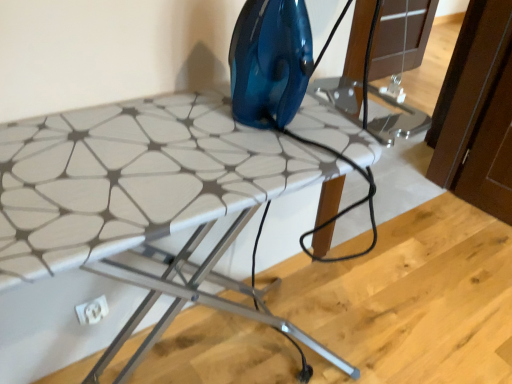
Question: Is white plastic electric outlet at lower left taller or shorter than white textured ironing board at center?

Choices:
 (A) short
 (B) tall

Answer: (A)

Question: Is white plastic electric outlet at lower left bigger or smaller than white textured ironing board at center?

Choices:
 (A) big
 (B) small

Answer: (B)

Question: Considering the positions of point (92, 314) and point (59, 238), is point (92, 314) closer or farther from the camera than point (59, 238)?

Choices:
 (A) closer
 (B) farther

Answer: (B)

Question: Does point (9, 241) appear closer or farther from the camera than point (89, 324)?

Choices:
 (A) closer
 (B) farther

Answer: (A)

Question: In terms of height, does white textured ironing board at center look taller or shorter compared to white plastic electric outlet at lower left?

Choices:
 (A) short
 (B) tall

Answer: (B)

Question: Is white textured ironing board at center inside the boundaries of white plastic electric outlet at lower left, or outside?

Choices:
 (A) outside
 (B) inside

Answer: (A)

Question: Relative to white plastic electric outlet at lower left, is white textured ironing board at center in front or behind?

Choices:
 (A) front
 (B) behind

Answer: (A)